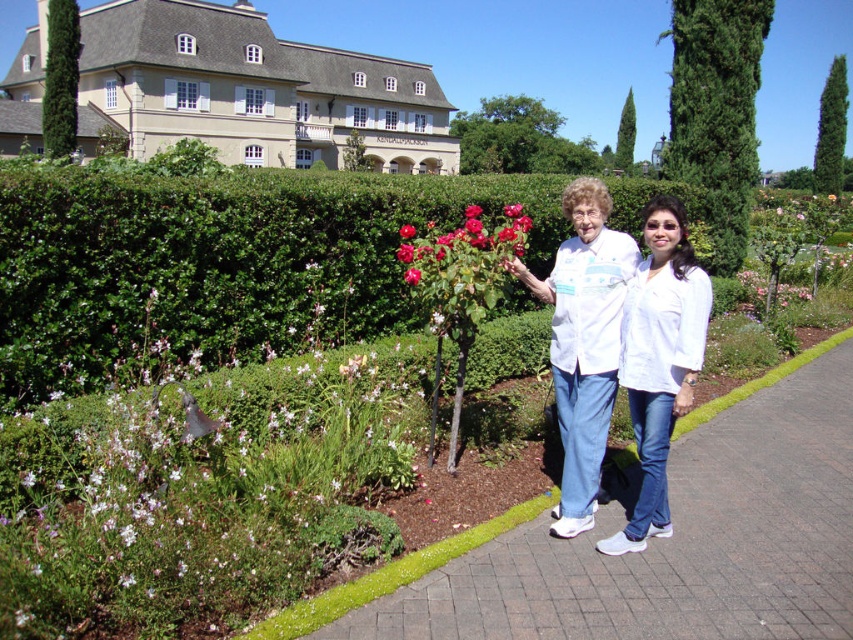
You are a photographer trying to capture the white cotton shirt at center and the green leafy bush at upper right in the same frame. Based on their positions, which object should you adjust your camera to focus on first if you want to include both in your shot?

The white cotton shirt at center is positioned on the left side of the green leafy bush at upper right. To include both in the shot, focus on the white cotton shirt at center first since it is closer to the left edge, then adjust to ensure the green leafy bush at upper right is also in frame.

You are a photographer trying to capture a photo of both the white matte shirt at center and the white textured shirt at center. Since you want them both in the frame, which shirt should you position closer to the left side of the camera?

The white textured shirt at center should be positioned closer to the left side of the camera because the white matte shirt at center is to the right of it.

Looking at this image, you are a tailor measuring shirts for alterations. You have two shirts in front of you on a table in the garden scene described. The white matte shirt at center and the white textured shirt at center. Which shirt has a larger width that requires more fabric for alterations?

The white matte shirt at center has a larger width than the white textured shirt at center, so it requires more fabric for alterations.